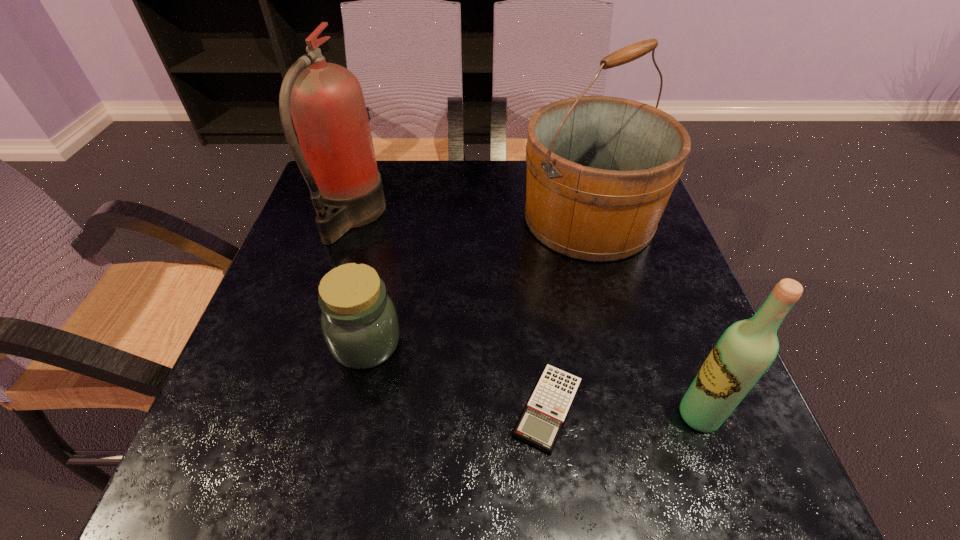
Where is `fire extinguisher`? The width and height of the screenshot is (960, 540). fire extinguisher is located at coordinates (337, 161).

You are a GUI agent. You are given a task and a screenshot of the screen. Output one action in this format:
    pyautogui.click(x=<x>, y=<y>)
    Task: Click on the bucket
    The height and width of the screenshot is (540, 960).
    Given the screenshot: What is the action you would take?
    pyautogui.click(x=600, y=170)

Locate an element on the screen. This screenshot has width=960, height=540. the third shortest object is located at coordinates (747, 348).

You are a GUI agent. You are given a task and a screenshot of the screen. Output one action in this format:
    pyautogui.click(x=<x>, y=<y>)
    Task: Click on the second shortest object
    This screenshot has height=540, width=960.
    Given the screenshot: What is the action you would take?
    pyautogui.click(x=359, y=322)

Where is `the shortest object`? the shortest object is located at coordinates (540, 424).

The height and width of the screenshot is (540, 960). Identify the location of blank space located 0.340m at the nozzle of the fire extinguisher. (519, 217).

You are a GUI agent. You are given a task and a screenshot of the screen. Output one action in this format:
    pyautogui.click(x=<x>, y=<y>)
    Task: Click on the free location located 0.250m on the front of the bucket
    The image size is (960, 540).
    Given the screenshot: What is the action you would take?
    pyautogui.click(x=627, y=362)

I want to click on vacant area situated on the front-facing side of the third tallest object, so click(607, 415).

The height and width of the screenshot is (540, 960). I want to click on vacant area situated on the front-facing side of the third tallest object, so click(x=618, y=415).

You are a GUI agent. You are given a task and a screenshot of the screen. Output one action in this format:
    pyautogui.click(x=<x>, y=<y>)
    Task: Click on the free point located 0.270m on the front-facing side of the third tallest object
    The image size is (960, 540).
    Given the screenshot: What is the action you would take?
    pyautogui.click(x=516, y=415)